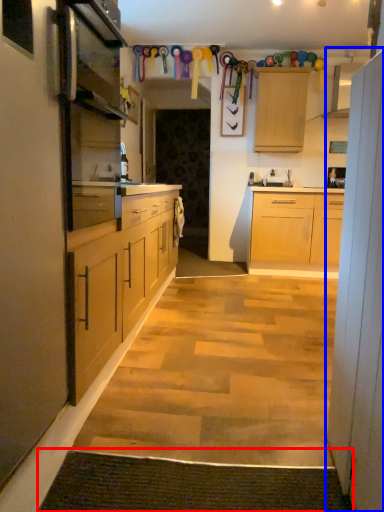
Question: Which of the following is the farthest to the observer, doormat (highlighted by a red box) or cabinet (highlighted by a blue box)?

Choices:
 (A) doormat
 (B) cabinet

Answer: (A)